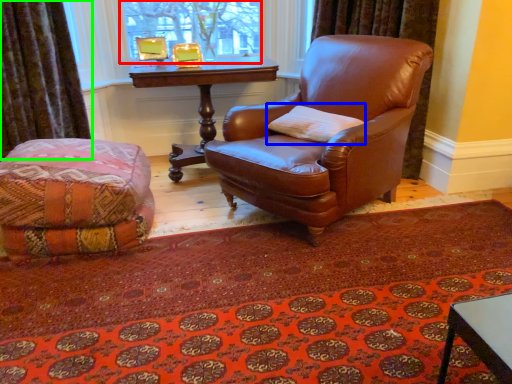
Question: Based on their relative distances, which object is nearer to bay window (highlighted by a red box)? Choose from pillow (highlighted by a blue box) and curtain (highlighted by a green box).

Choices:
 (A) pillow
 (B) curtain

Answer: (B)